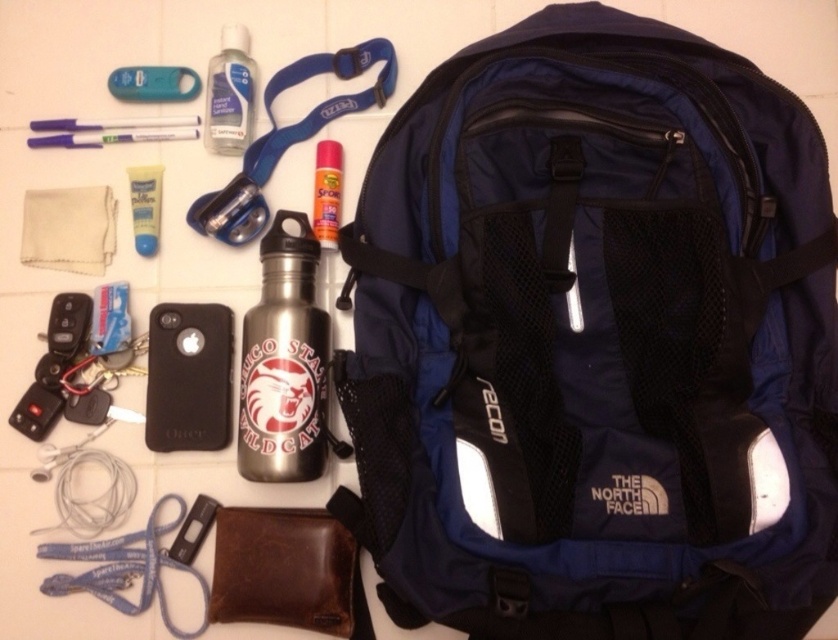
Can you confirm if clear plastic bottle at upper center is positioned below metallic silver spray can at center?

Actually, clear plastic bottle at upper center is above metallic silver spray can at center.

Who is shorter, clear plastic bottle at upper center or metallic silver spray can at center?

metallic silver spray can at center

Find the location of a particular element. clear plastic bottle at upper center is located at coordinates (230, 93).

Which is more to the right, brushed metal water bottle at center or clear plastic bottle at upper center?

brushed metal water bottle at center

This screenshot has width=838, height=640. What do you see at coordinates (283, 362) in the screenshot? I see `brushed metal water bottle at center` at bounding box center [283, 362].

Where is `brushed metal water bottle at center`? brushed metal water bottle at center is located at coordinates (283, 362).

Can you confirm if navy blue fabric backpack at upper center is wider than teal plastic keychain at upper left?

Yes, navy blue fabric backpack at upper center is wider than teal plastic keychain at upper left.

Who is taller, navy blue fabric backpack at upper center or teal plastic keychain at upper left?

navy blue fabric backpack at upper center

Does point (442, 563) come behind point (153, 100)?

No, (442, 563) is in front of (153, 100).

I want to click on navy blue fabric backpack at upper center, so click(596, 340).